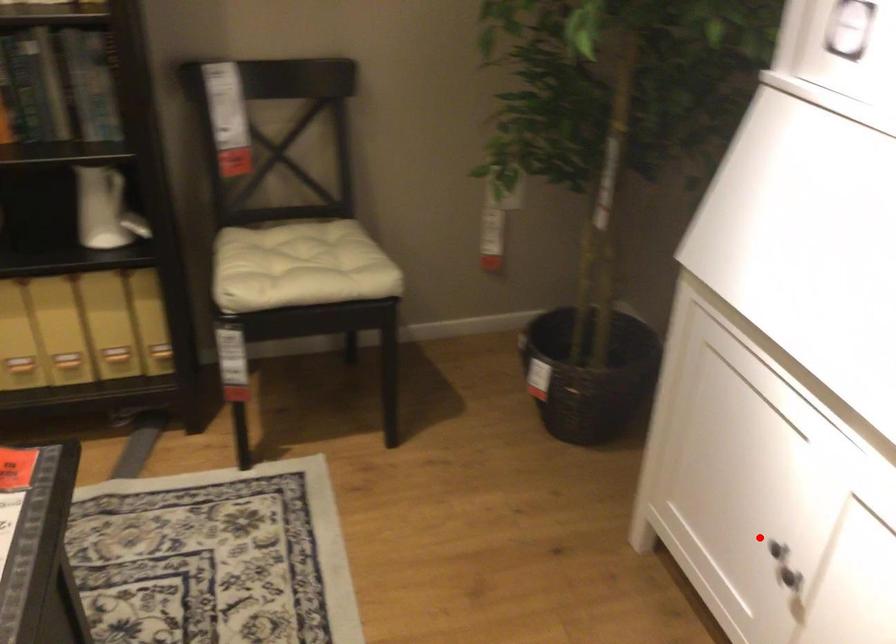
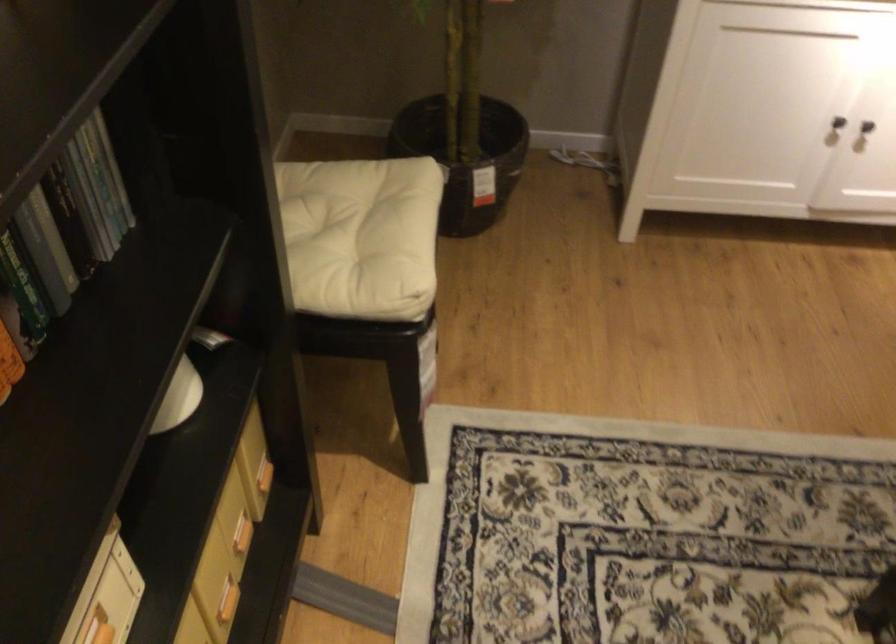
Find the pixel in the second image that matches the highlighted location in the first image.

(838, 122)